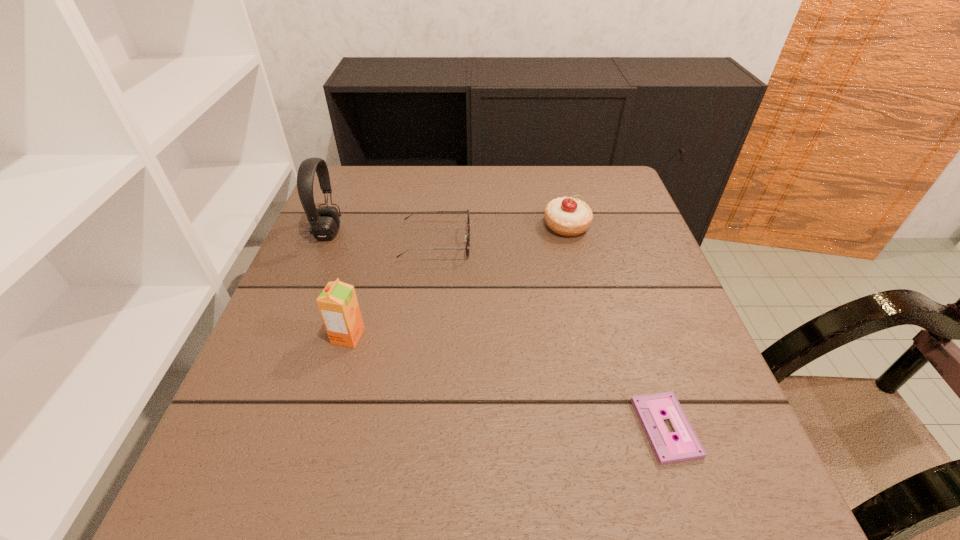
Locate an element on the screen. This screenshot has width=960, height=540. free location located on the back of the second tallest object is located at coordinates (364, 280).

Find the location of a particular element. The image size is (960, 540). free space located 0.210m on the left of the third shortest object is located at coordinates (461, 226).

Find the location of a particular element. blank space located 0.260m through the lenses of the fourth tallest object is located at coordinates (578, 244).

Locate an element on the screen. vacant space located 0.230m on the back of the videotape is located at coordinates coord(623,299).

Where is `headset that is at the left edge`? This screenshot has height=540, width=960. headset that is at the left edge is located at coordinates (324, 221).

Locate an element on the screen. This screenshot has width=960, height=540. orange juice located at the left edge is located at coordinates (338, 305).

The width and height of the screenshot is (960, 540). Find the location of `pastry present at the right edge`. pastry present at the right edge is located at coordinates (566, 216).

The image size is (960, 540). In order to click on videotape that is at the right edge in this screenshot , I will do `click(649, 408)`.

At what (x,y) coordinates should I click in order to perform the action: click on free spot at the far edge of the desktop. Please return your answer as a coordinate pair (x, y). This screenshot has width=960, height=540. Looking at the image, I should click on (469, 200).

Image resolution: width=960 pixels, height=540 pixels. In the image, there is a desktop. What are the coordinates of `vacant region at the near edge` in the screenshot? It's located at (580, 523).